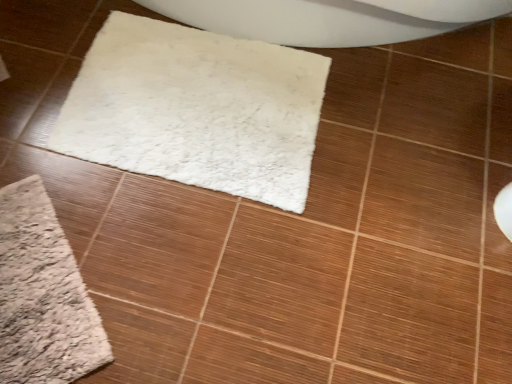
Find the location of a particular element. Image resolution: width=512 pixels, height=384 pixels. vacant space in between white fluffy mat at center and beige fuzzy bath mat at lower left is located at coordinates (134, 210).